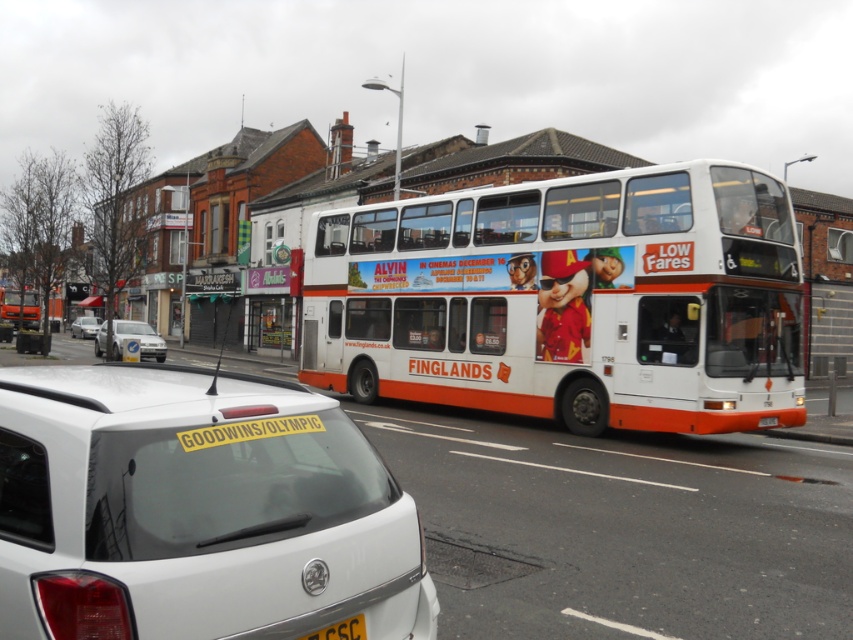
You are a delivery driver who needs to park your truck between the white matte van at left and the yellow matte license plate at center. The truck requires 25 meters of space. Is there enough space?

The white matte van at left is 30.00 meters away from the yellow matte license plate at center, so yes, there is enough space to park the truck between them since the required 25 meters is less than the available distance.

You are standing on the sidewalk and see two points marked on the road ahead. The first point is at coordinates point (22, 317) and the second is at point (83, 337). Which point is closer to you?

Point (22, 317) is closer to you because it is further to the viewer than point (83, 337).

You are a pedestrian standing at the crosswalk between the white matte van at left and the white car with yellow sticker on rear window. The crosswalk is 100 feet long. Can you safely cross the crosswalk without waiting for the traffic light?

The distance between the white matte van at left and the white car with yellow sticker on rear window is 92.67 feet, which is less than the 100 feet crosswalk length. Therefore, there is a gap of approximately 7.33 feet remaining. However, since vehicles may be moving or stationary, it is unsafe to cross without waiting for the traffic light to ensure safety.